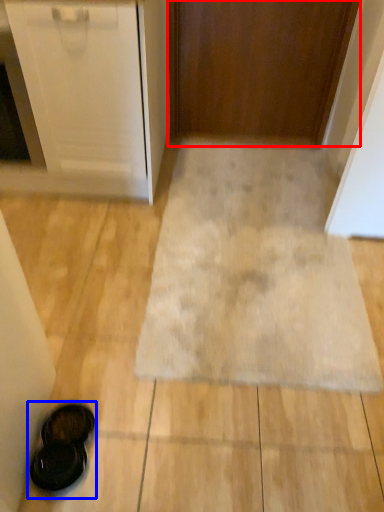
Question: Which object is closer to the camera taking this photo, door (highlighted by a red box) or footwear (highlighted by a blue box)?

Choices:
 (A) door
 (B) footwear

Answer: (B)